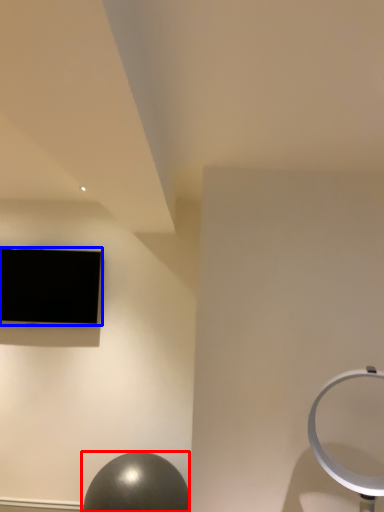
Question: Which object appears closest to the camera in this image, ball (highlighted by a red box) or television (highlighted by a blue box)?

Choices:
 (A) ball
 (B) television

Answer: (A)